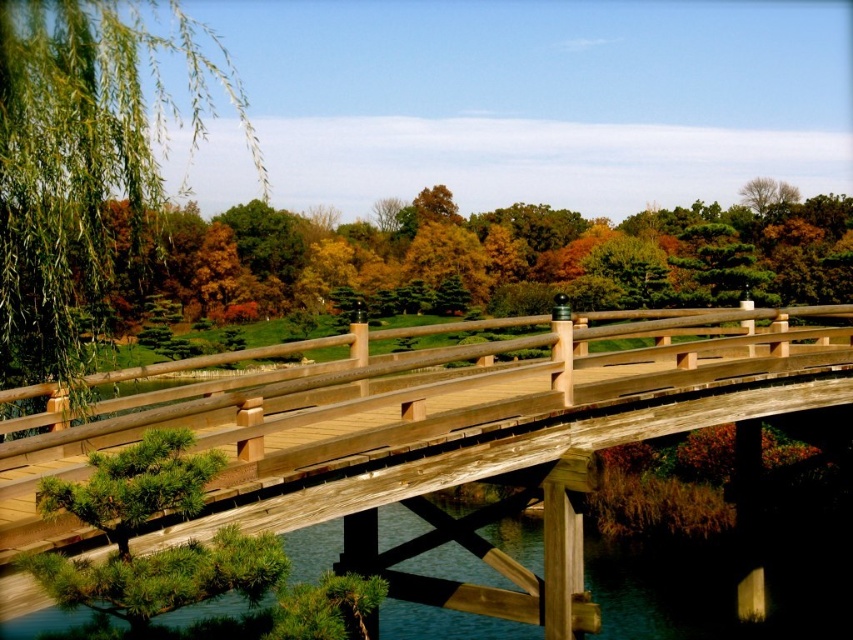
Is wooden bridge at center closer to camera compared to green matte tree at upper left?

Yes, wooden bridge at center is in front of green matte tree at upper left.

Describe the element at coordinates (479, 445) in the screenshot. I see `wooden bridge at center` at that location.

The width and height of the screenshot is (853, 640). Identify the location of wooden bridge at center. (479, 445).

Which is in front, point (664, 301) or point (114, 184)?

Point (114, 184) is in front.

Is point (494, 252) less distant than point (148, 51)?

Yes, it is.

This screenshot has width=853, height=640. I want to click on green matte tree at upper left, so click(x=476, y=260).

Does wooden bridge at center appear on the right side of green leafy willow at left?

Yes, wooden bridge at center is to the right of green leafy willow at left.

Is wooden bridge at center bigger than green leafy willow at left?

Actually, wooden bridge at center might be smaller than green leafy willow at left.

The image size is (853, 640). Identify the location of wooden bridge at center. (x=479, y=445).